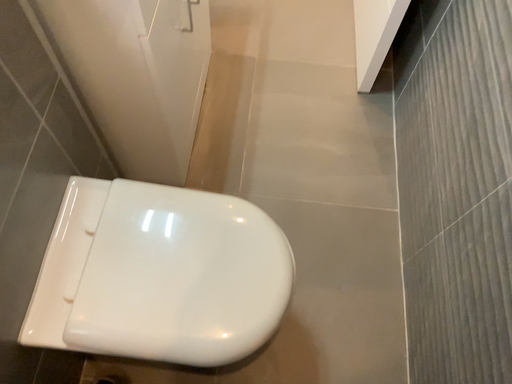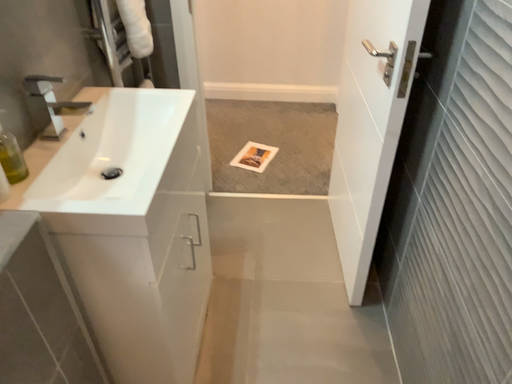
Question: Which way did the camera rotate in the video?

Choices:
 (A) rotated upward
 (B) rotated downward

Answer: (A)